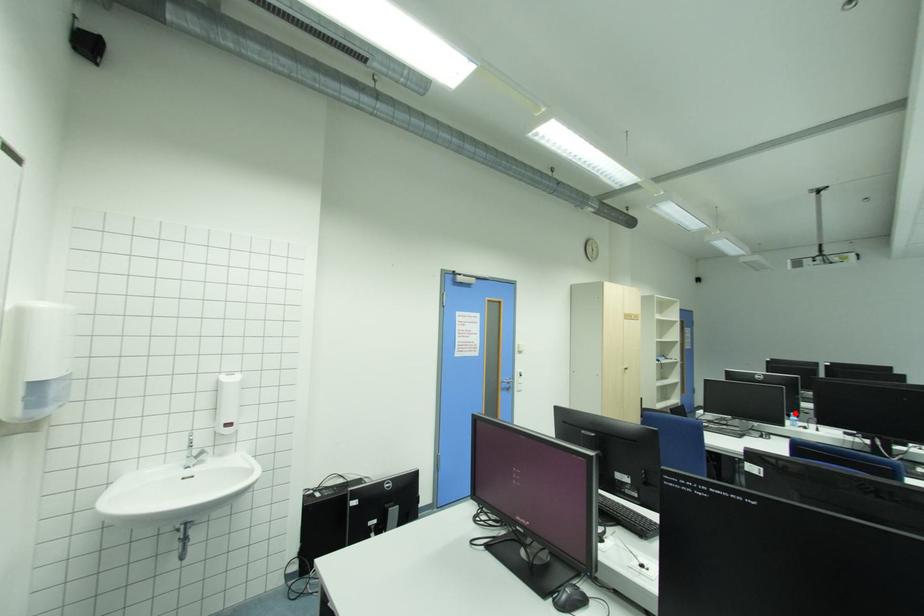
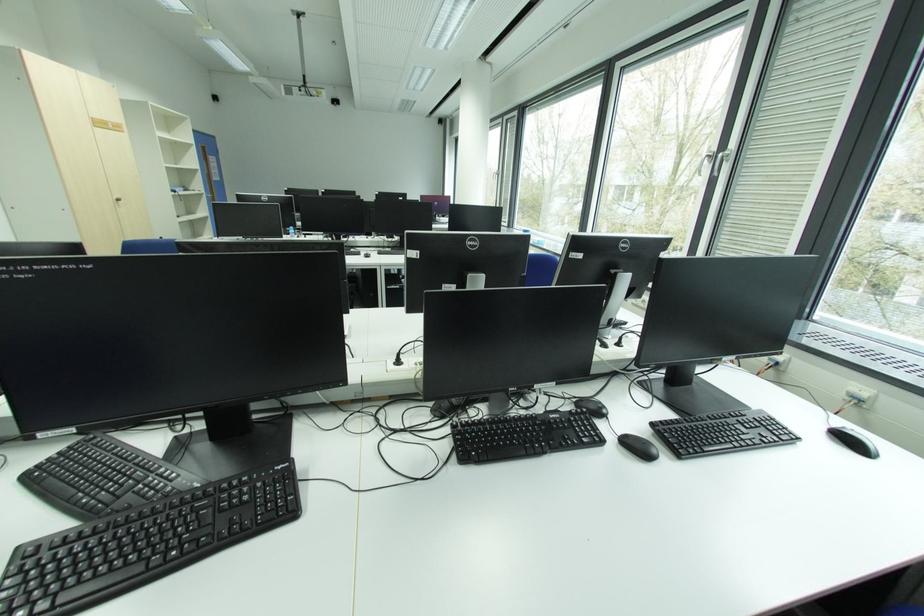
The point at the highlighted location is marked in the first image. Where is the corresponding point in the second image?

(293, 228)